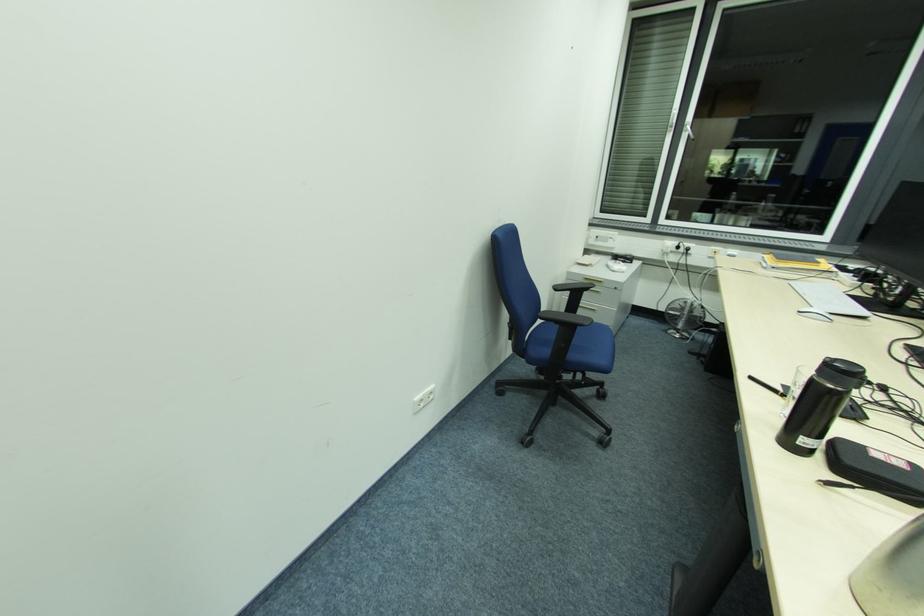
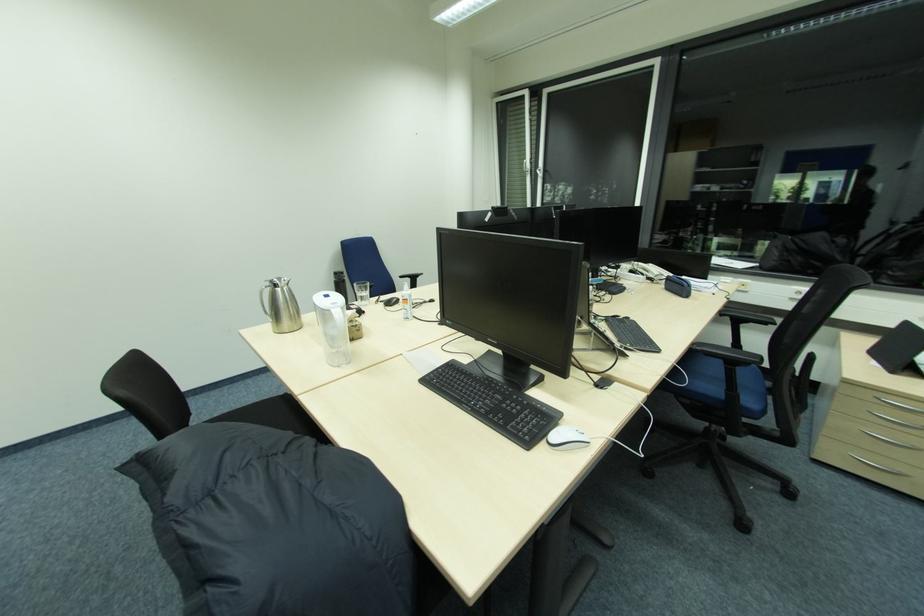
From the picture: The images are taken continuously from a first-person perspective. In which direction are you moving?

The movement direction of the cameraman is right, backward.